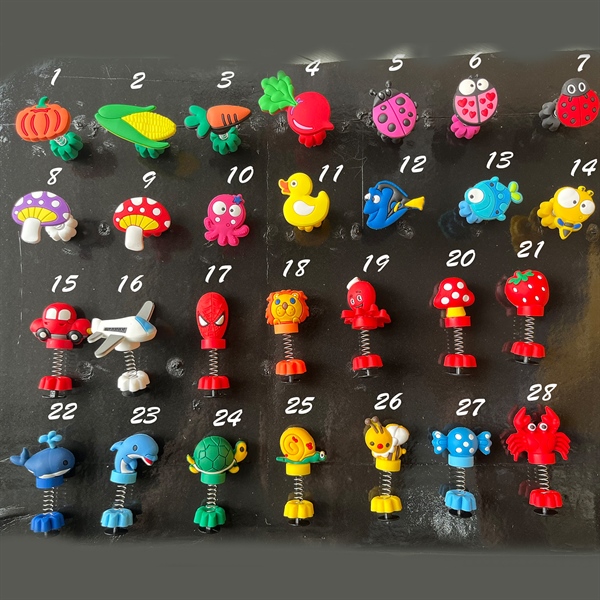
The image size is (600, 600). Identify the location of second row of toys. (54, 212), (156, 210), (226, 219), (322, 206), (385, 207), (474, 202), (562, 211).